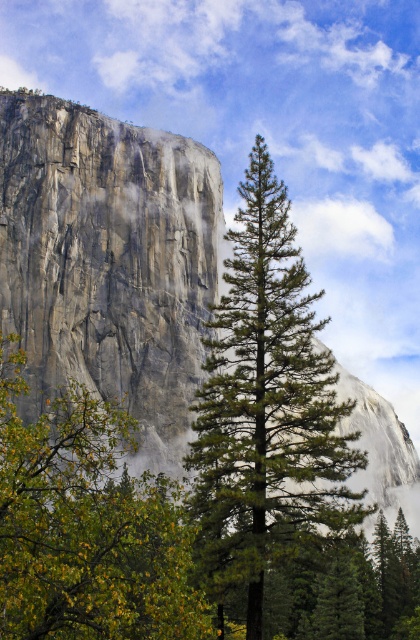
Question: From the image, what is the correct spatial relationship of green textured pine tree at center in relation to green leafy tree at center?

Choices:
 (A) left
 (B) right

Answer: (B)

Question: Which object is closer to the camera taking this photo?

Choices:
 (A) green textured pine tree at center
 (B) green leafy tree at center
 (C) granite cliff face at left

Answer: (B)

Question: Among these points, which one is farthest from the camera?

Choices:
 (A) (325, 358)
 (B) (109, 228)
 (C) (99, 122)
 (D) (15, 598)

Answer: (C)

Question: Can you confirm if rocky cliff at center is smaller than green textured pine tree at center?

Choices:
 (A) no
 (B) yes

Answer: (A)

Question: Considering the relative positions of rocky cliff at center and granite cliff face at left in the image provided, where is rocky cliff at center located with respect to granite cliff face at left?

Choices:
 (A) above
 (B) below

Answer: (B)

Question: Which of the following is the closest to the observer?

Choices:
 (A) rocky cliff at center
 (B) granite cliff face at left

Answer: (A)